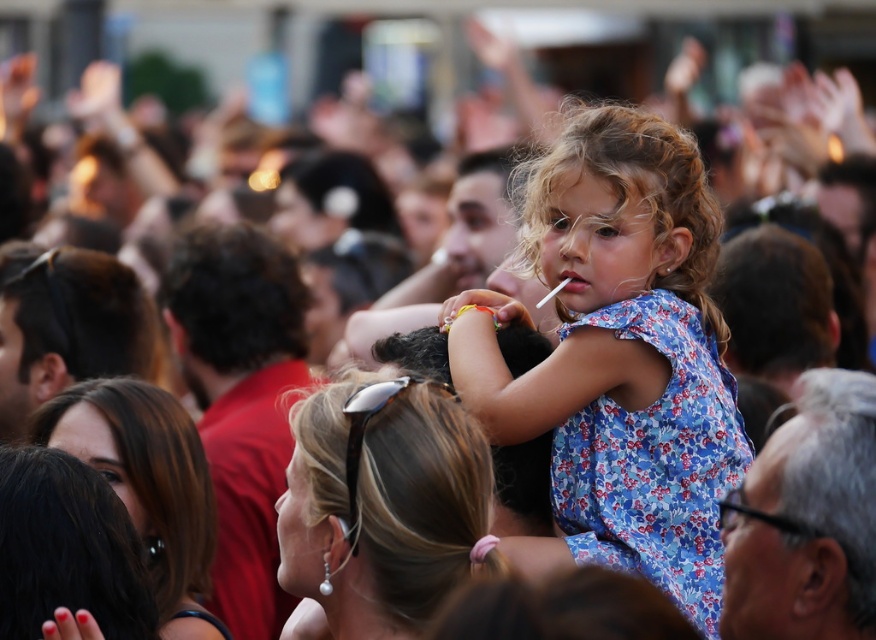
You are a photographer trying to capture the young girl in the blue floral dress at center. Given that your camera has a focal point set at coordinates 0.5,0.7, will the girl be in focus?

The blue floral dress at center is located at coordinates (620, 358), which is very close to the camera focal point at (612, 320). Therefore, the girl will likely be in focus.

You are standing at the center of the crowd and see the dark brown hair at lower left and the yellow rubber band at center. Which object is closer to you?

The yellow rubber band at center is closer to you because it is at the center, while the dark brown hair at lower left is 4.08 meters away from it.

You are a photographer trying to capture a closeup of the yellow rubber band at center without including the dark brown hair at lower left in the frame. Based on their positions and sizes, is this possible?

The dark brown hair at lower left might be wider than the yellow rubber band at center, so it could potentially block the view. To ensure the yellow rubber band at center is captured without the dark brown hair at lower left, adjust the camera angle or position to avoid overlap.